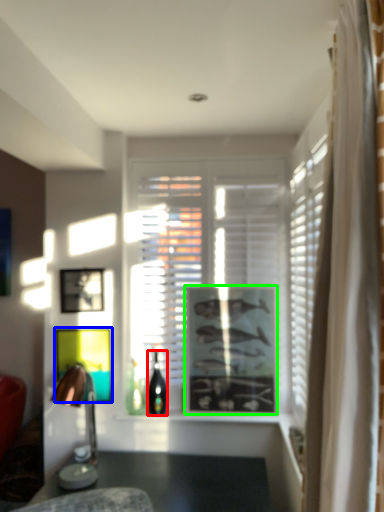
Question: Considering the real-world distances, which object is farthest from bottle (highlighted by a red box)? picture frame (highlighted by a blue box) or picture frame (highlighted by a green box)?

Choices:
 (A) picture frame
 (B) picture frame

Answer: (B)